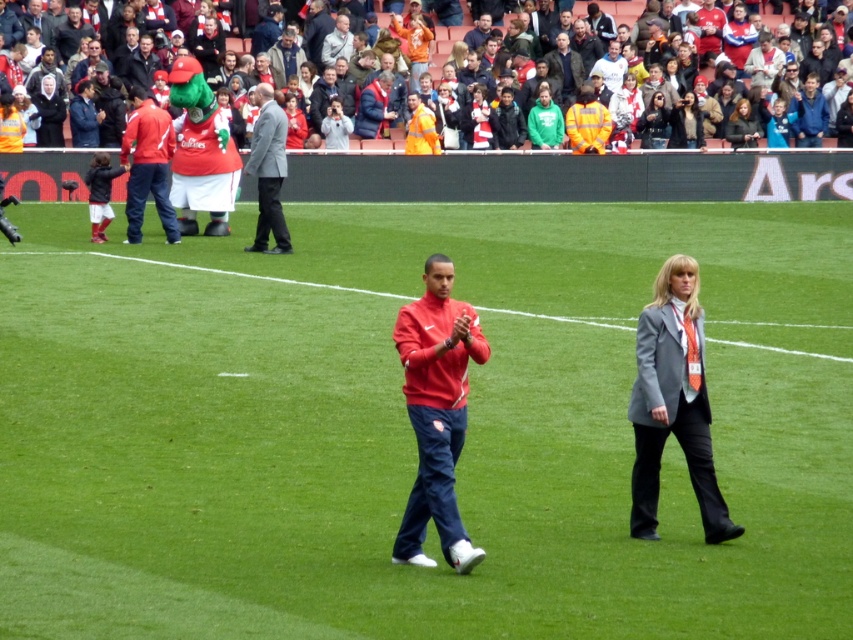
Based on the scene description, can you determine which object is larger between the gray fabric jacket at lower right and the red fabric crowd at upper center?

The gray fabric jacket at lower right is smaller than the red fabric crowd at upper center, so the red fabric crowd at upper center is larger.

You are a photographer positioned at the edge of the field. You need to capture a photo of both the matte red jacket at upper left and the gray suit at center in the same frame. Considering the distance between them, will you be able to fit both subjects into your camera view without moving your position?

The distance between the matte red jacket at upper left and the gray suit at center is 5.68 feet. Since the photographer is at the edge of the field, a standard camera lens can easily capture both subjects within the same frame without needing to move, as 5.68 feet is a manageable distance for most camera angles.